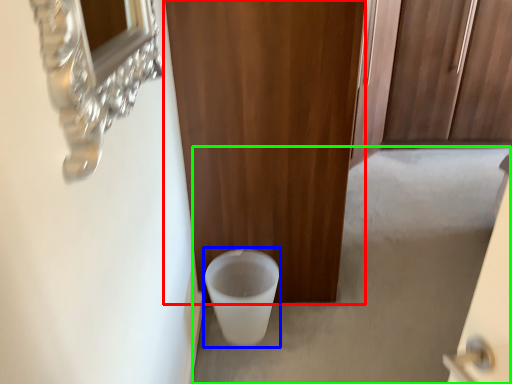
Question: Estimate the real-world distances between objects in this image. Which object is farther from door (highlighted by a red box), toilet bowl (highlighted by a blue box) or concrete (highlighted by a green box)?

Choices:
 (A) toilet bowl
 (B) concrete

Answer: (B)